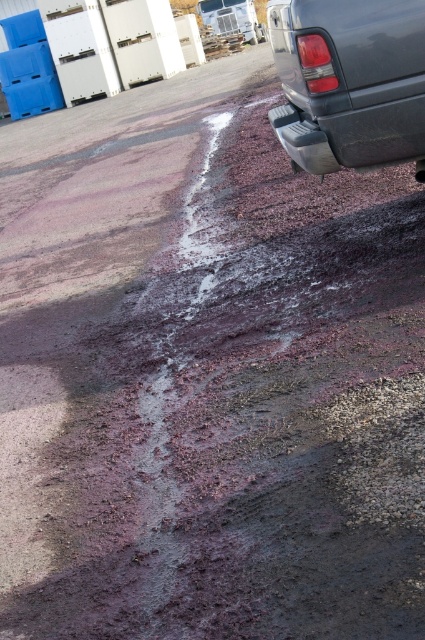
Which of these two, glossy plastic truck at upper right or brushed metal truck at upper right, stands shorter?

glossy plastic truck at upper right

Who is positioned more to the right, glossy plastic truck at upper right or brushed metal truck at upper right?

glossy plastic truck at upper right

What do you see at coordinates (350, 81) in the screenshot? This screenshot has height=640, width=425. I see `glossy plastic truck at upper right` at bounding box center [350, 81].

This screenshot has height=640, width=425. I want to click on glossy plastic truck at upper right, so click(x=350, y=81).

Is glossy plastic truck at upper right thinner than black rubber tire at lower right?

No.

Who is lower down, glossy plastic truck at upper right or black rubber tire at lower right?

Positioned lower is glossy plastic truck at upper right.

Is point (339, 125) in front of point (249, 38)?

Yes, it is.

You are a GUI agent. You are given a task and a screenshot of the screen. Output one action in this format:
    pyautogui.click(x=<x>, y=<y>)
    Task: Click on the glossy plastic truck at upper right
    The width and height of the screenshot is (425, 640).
    Given the screenshot: What is the action you would take?
    pyautogui.click(x=350, y=81)

Does brushed metal truck at upper right appear under black rubber tire at lower right?

Incorrect, brushed metal truck at upper right is not positioned below black rubber tire at lower right.

Is brushed metal truck at upper right thinner than black rubber tire at lower right?

Incorrect, brushed metal truck at upper right's width is not less than black rubber tire at lower right's.

Is point (232, 29) farther from camera compared to point (257, 42)?

Yes, point (232, 29) is farther from viewer.

Where is `brushed metal truck at upper right`? Image resolution: width=425 pixels, height=640 pixels. brushed metal truck at upper right is located at coordinates (232, 17).